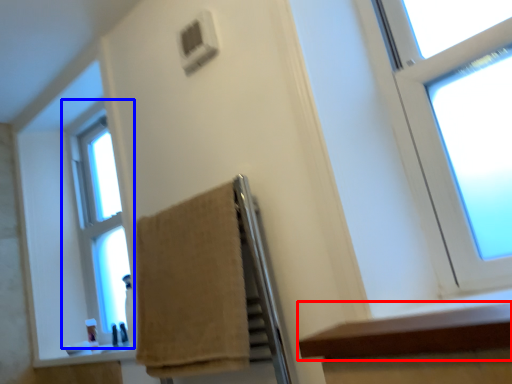
Question: Which object is closer to the camera taking this photo, ledge (highlighted by a red box) or window (highlighted by a blue box)?

Choices:
 (A) ledge
 (B) window

Answer: (A)